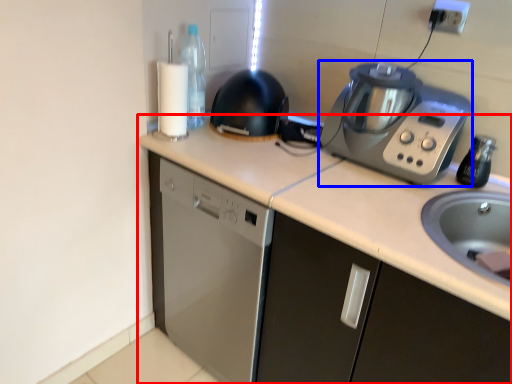
Question: Which object is closer to the camera taking this photo, countertop (highlighted by a red box) or home appliance (highlighted by a blue box)?

Choices:
 (A) countertop
 (B) home appliance

Answer: (A)